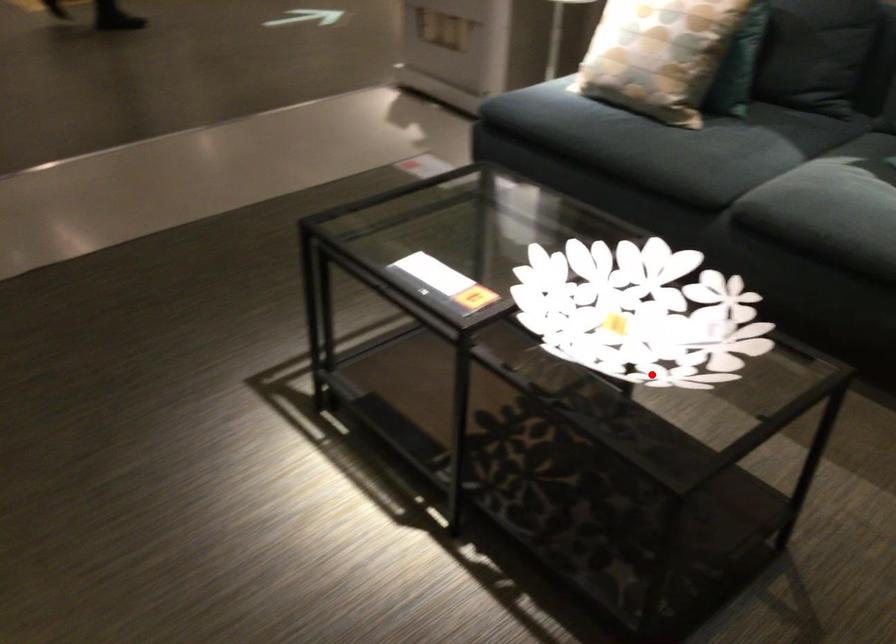
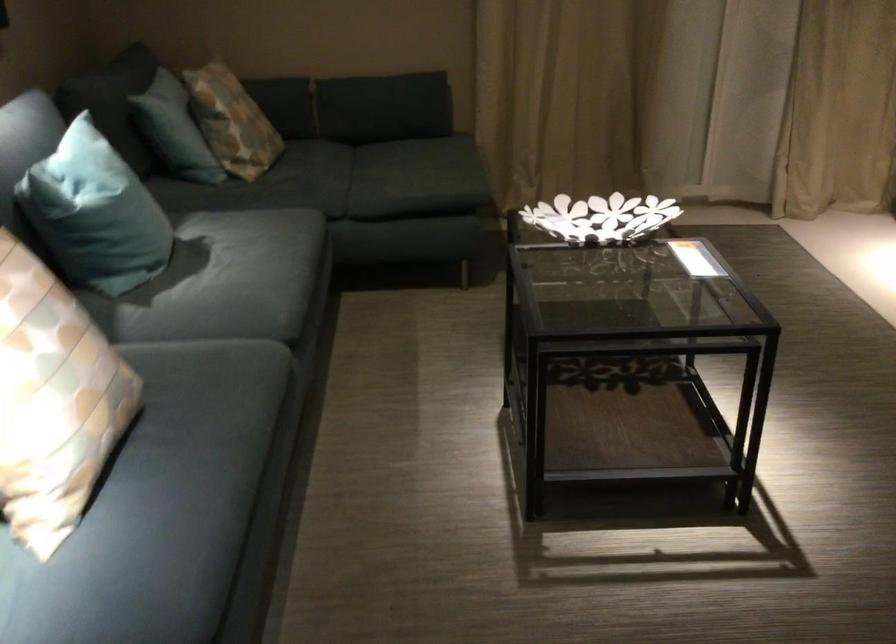
Question: I am providing you with two images of the same scene from different viewpoints. Image1 has a red point marked. In image2, the corresponding 3D location appears at what relative position? Reply with the corresponding letter.

Choices:
 (A) Closer
 (B) Farther

Answer: (B)